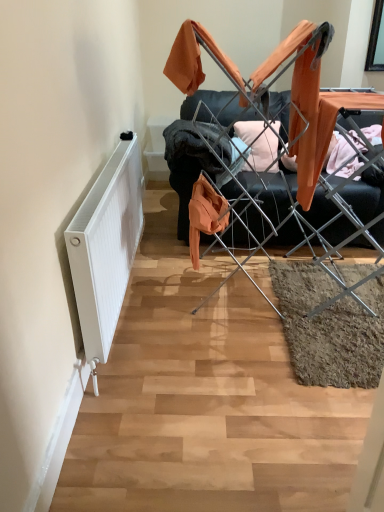
Question: Considering the positions of point (182, 119) and point (309, 137), is point (182, 119) closer or farther from the camera than point (309, 137)?

Choices:
 (A) farther
 (B) closer

Answer: (A)

Question: Looking at the image, does orange fabric at center seem bigger or smaller compared to metal drying rack at center?

Choices:
 (A) big
 (B) small

Answer: (B)

Question: Estimate the real-world distances between objects in this image. Which object is farther from the metal drying rack at center?

Choices:
 (A) white matte radiator at left
 (B) orange fabric at center

Answer: (A)

Question: Which object is positioned farthest from the metal drying rack at center?

Choices:
 (A) white matte radiator at left
 (B) orange fabric at center

Answer: (A)